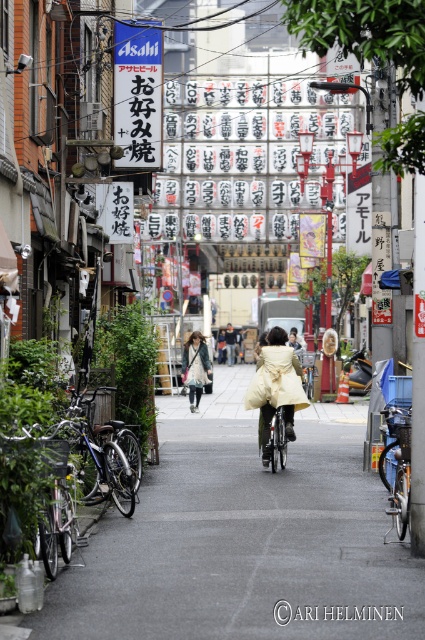
You are a delivery person standing at the entrance of the street. You need to deliver a package to the black paper at center and then to the matte beige coat at center. Can you reach both locations without moving more than 30 meters from your starting point?

The distance between the black paper at center and the matte beige coat at center is 24.36 meters. Since you need to go from the starting point to the black paper at center first, then to the matte beige coat at center, the total distance would be more than 24.36 meters. However, without knowing the exact path or the position of the starting point relative to both objects, it is impossible to determine if the total distance stays under 30 meters. The given information only specifies the distance between the

You are a delivery person who needs to pick up a package from the shiny metallic bicycle at center and then deliver it to the matte beige coat at center. Which direction should you move relative to the bicycle to reach the coat?

The shiny metallic bicycle at center is to the right of the matte beige coat at center, so you should move to the left relative to the bicycle to reach the coat.